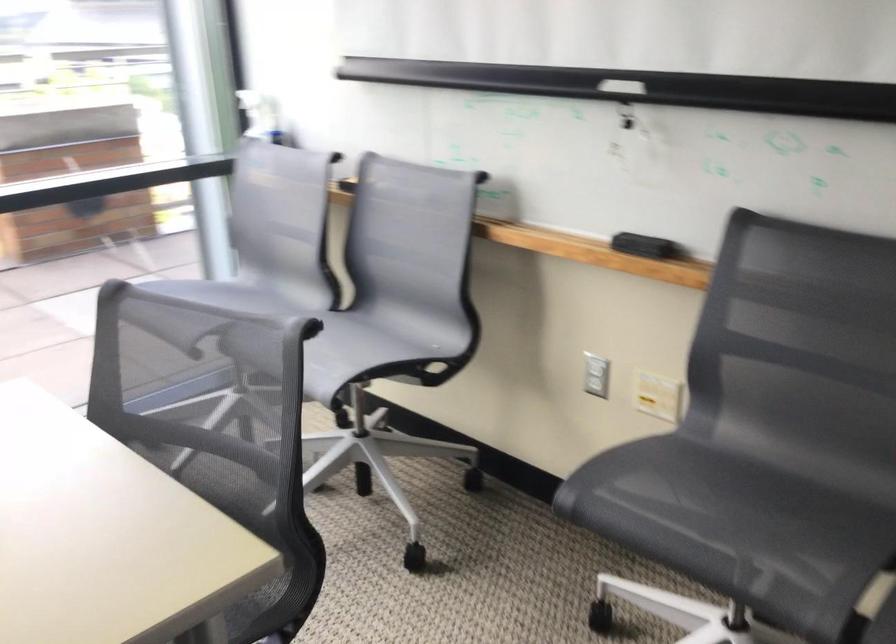
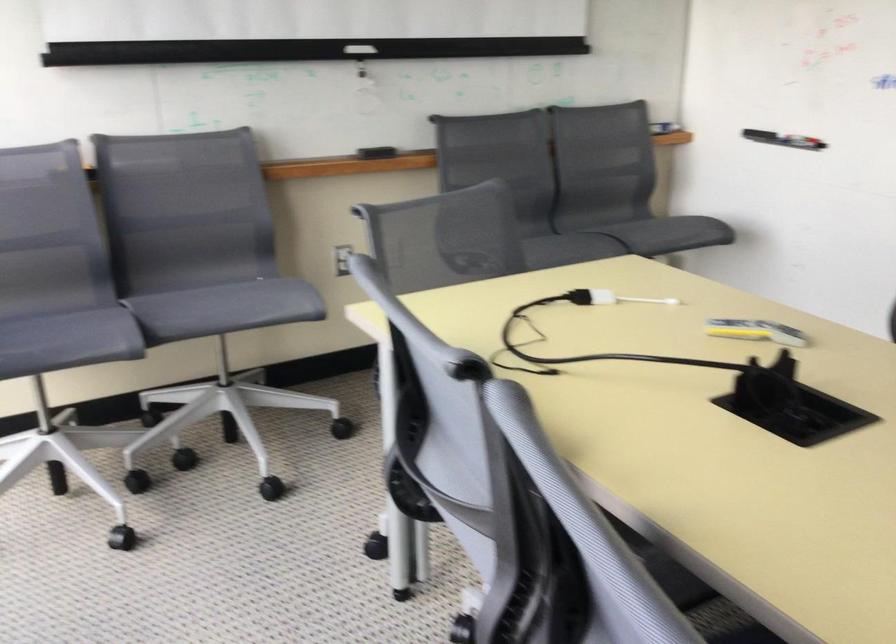
Find the pixel in the second image that matches point (636, 91) in the first image.

(359, 49)